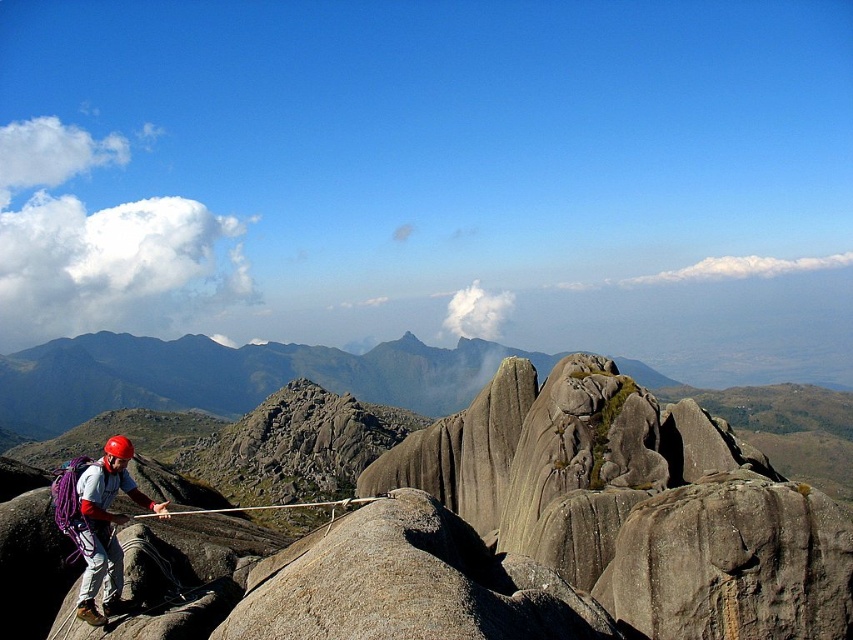
Question: Does gray rock formation at center come in front of matte gray helmet at left?

Choices:
 (A) no
 (B) yes

Answer: (A)

Question: Which point is closer to the camera?

Choices:
 (A) matte gray helmet at left
 (B) gray rock formation at center

Answer: (A)

Question: Does gray rock formation at center have a lesser width compared to matte gray helmet at left?

Choices:
 (A) yes
 (B) no

Answer: (B)

Question: Among these objects, which one is nearest to the camera?

Choices:
 (A) matte gray helmet at left
 (B) gray rock formation at center

Answer: (A)

Question: Does gray rock formation at center have a smaller size compared to matte gray helmet at left?

Choices:
 (A) no
 (B) yes

Answer: (A)